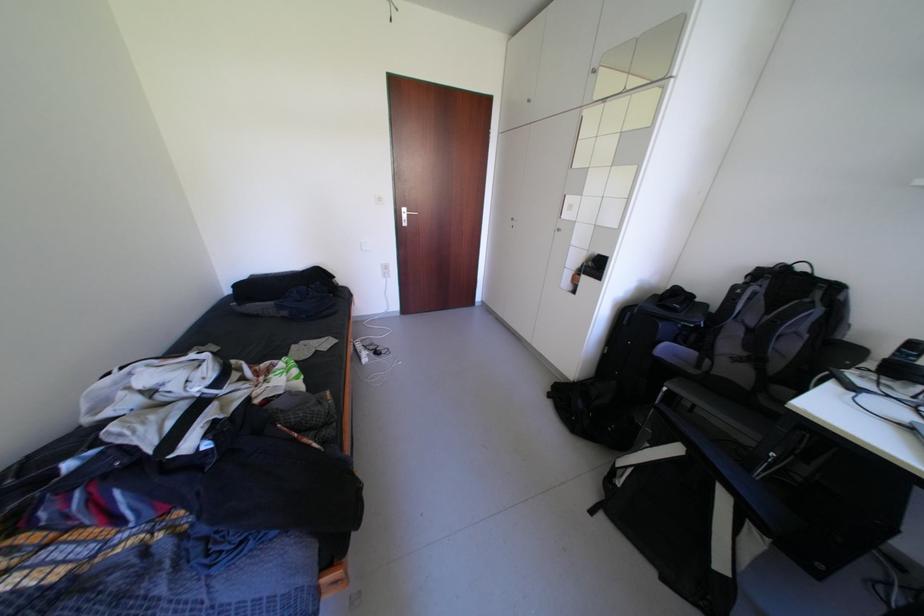
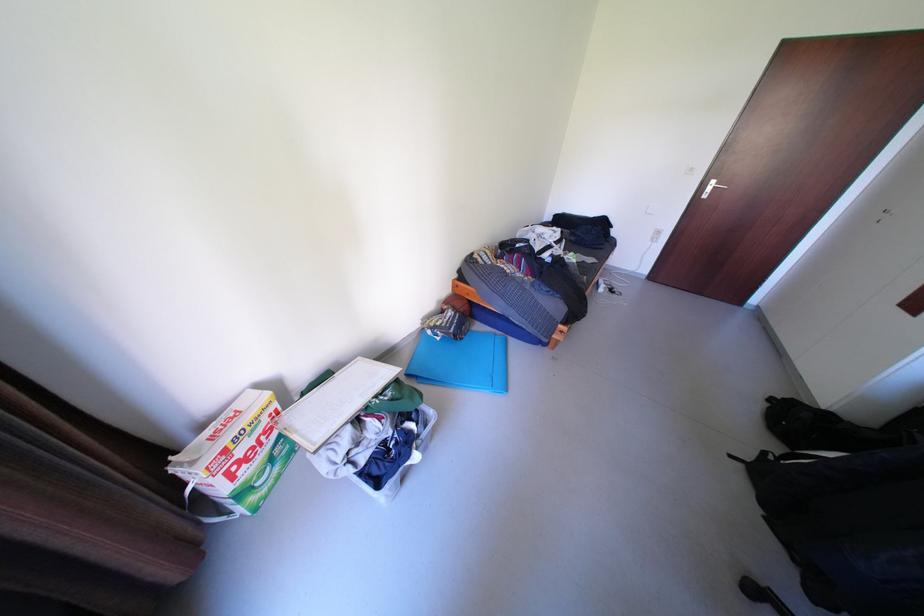
Locate, in the second image, the point that corresponds to (613,516) in the first image.

(752, 466)